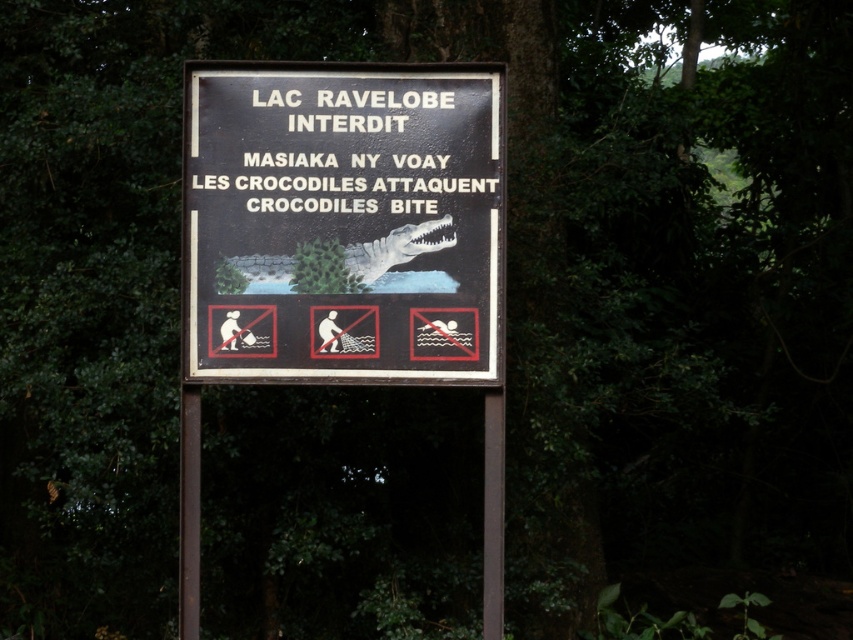
Question: In this image, where is black plastic sign at center located relative to metallic pole at center?

Choices:
 (A) below
 (B) above

Answer: (B)

Question: Does black plastic sign at center appear under metallic pole at center?

Choices:
 (A) yes
 (B) no

Answer: (B)

Question: Which object appears farthest from the camera in this image?

Choices:
 (A) black plastic sign at center
 (B) metallic pole at center

Answer: (B)

Question: Considering the relative positions of black plastic sign at center and metallic pole at center in the image provided, where is black plastic sign at center located with respect to metallic pole at center?

Choices:
 (A) right
 (B) left

Answer: (B)

Question: Which point appears farthest from the camera in this image?

Choices:
 (A) (430, 250)
 (B) (496, 525)

Answer: (B)